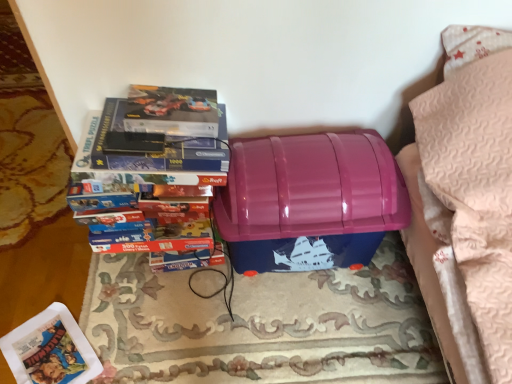
Question: From the image's perspective, is matte plastic paperback book at lower left beneath rug/carpet at center?

Choices:
 (A) no
 (B) yes

Answer: (B)

Question: Is rug/carpet at center at the back of matte plastic paperback book at lower left?

Choices:
 (A) yes
 (B) no

Answer: (A)

Question: Is matte plastic paperback book at lower left wider than rug/carpet at center?

Choices:
 (A) yes
 (B) no

Answer: (B)

Question: Considering the relative positions of matte plastic paperback book at lower left and rug/carpet at center in the image provided, is matte plastic paperback book at lower left to the left of rug/carpet at center from the viewer's perspective?

Choices:
 (A) no
 (B) yes

Answer: (B)

Question: Can you confirm if matte plastic paperback book at lower left is smaller than rug/carpet at center?

Choices:
 (A) no
 (B) yes

Answer: (B)

Question: From a real-world perspective, is rug/carpet at center above or below blue cardboard puzzle at left?

Choices:
 (A) above
 (B) below

Answer: (B)

Question: Considering the relative positions of rug/carpet at center and blue cardboard puzzle at left in the image provided, is rug/carpet at center to the left or to the right of blue cardboard puzzle at left?

Choices:
 (A) left
 (B) right

Answer: (B)

Question: From their relative heights in the image, would you say rug/carpet at center is taller or shorter than blue cardboard puzzle at left?

Choices:
 (A) short
 (B) tall

Answer: (A)

Question: Is rug/carpet at center wider or thinner than blue cardboard puzzle at left?

Choices:
 (A) thin
 (B) wide

Answer: (B)

Question: Considering the relative positions of rug/carpet at center and glossy plastic storage box at center in the image provided, is rug/carpet at center to the left or to the right of glossy plastic storage box at center?

Choices:
 (A) right
 (B) left

Answer: (B)

Question: Considering the positions of point (343, 377) and point (268, 201), is point (343, 377) closer or farther from the camera than point (268, 201)?

Choices:
 (A) farther
 (B) closer

Answer: (A)

Question: From a real-world perspective, is rug/carpet at center physically located above or below glossy plastic storage box at center?

Choices:
 (A) below
 (B) above

Answer: (A)

Question: In the image, is rug/carpet at center positioned in front of or behind glossy plastic storage box at center?

Choices:
 (A) front
 (B) behind

Answer: (B)

Question: From the image's perspective, is glossy plastic storage box at center above or below rug/carpet at center?

Choices:
 (A) above
 (B) below

Answer: (A)

Question: Looking at their shapes, would you say glossy plastic storage box at center is wider or thinner than rug/carpet at center?

Choices:
 (A) thin
 (B) wide

Answer: (A)